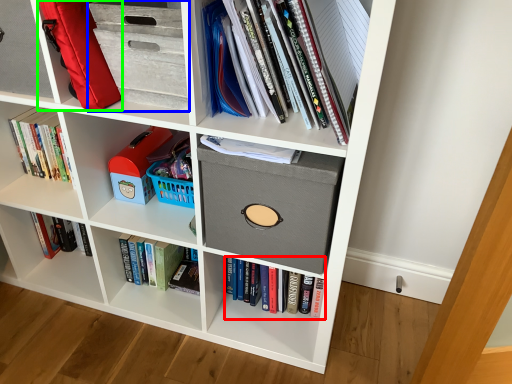
Question: Which is farther away from book (highlighted by a red box)? cabinet (highlighted by a blue box) or luggage (highlighted by a green box)?

Choices:
 (A) cabinet
 (B) luggage

Answer: (B)